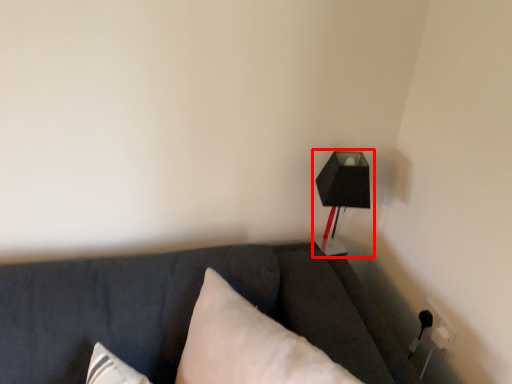
Question: From the image, what is the correct spatial relationship of lamp (annotated by the red box) in relation to pillow?

Choices:
 (A) left
 (B) right

Answer: (B)